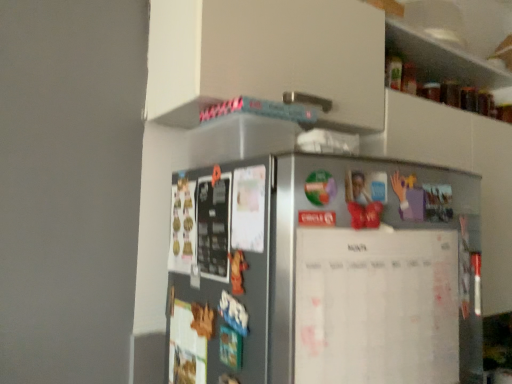
Question: Is white paperboard at center inside the boundaries of satin silver fridge at left, or outside?

Choices:
 (A) inside
 (B) outside

Answer: (B)

Question: Considering the relative positions of white paperboard at center and satin silver fridge at left in the image provided, is white paperboard at center to the left or to the right of satin silver fridge at left?

Choices:
 (A) left
 (B) right

Answer: (B)

Question: Does point (456, 261) appear closer or farther from the camera than point (261, 359)?

Choices:
 (A) closer
 (B) farther

Answer: (B)

Question: Is point (204, 382) positioned closer to the camera than point (352, 342)?

Choices:
 (A) farther
 (B) closer

Answer: (A)

Question: From a real-world perspective, relative to white paperboard at center, is satin silver fridge at left vertically above or below?

Choices:
 (A) below
 (B) above

Answer: (B)

Question: Would you say satin silver fridge at left is to the left or to the right of white paperboard at center in the picture?

Choices:
 (A) right
 (B) left

Answer: (B)

Question: Considering the positions of satin silver fridge at left and white paperboard at center in the image, is satin silver fridge at left bigger or smaller than white paperboard at center?

Choices:
 (A) small
 (B) big

Answer: (B)